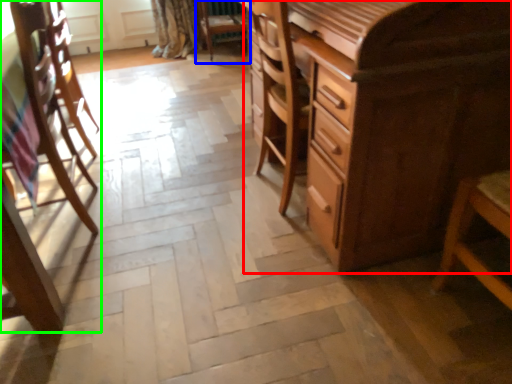
Question: Estimate the real-world distances between objects in this image. Which object is closer to chest of drawers (highlighted by a red box), chair (highlighted by a blue box) or chair (highlighted by a green box)?

Choices:
 (A) chair
 (B) chair

Answer: (B)